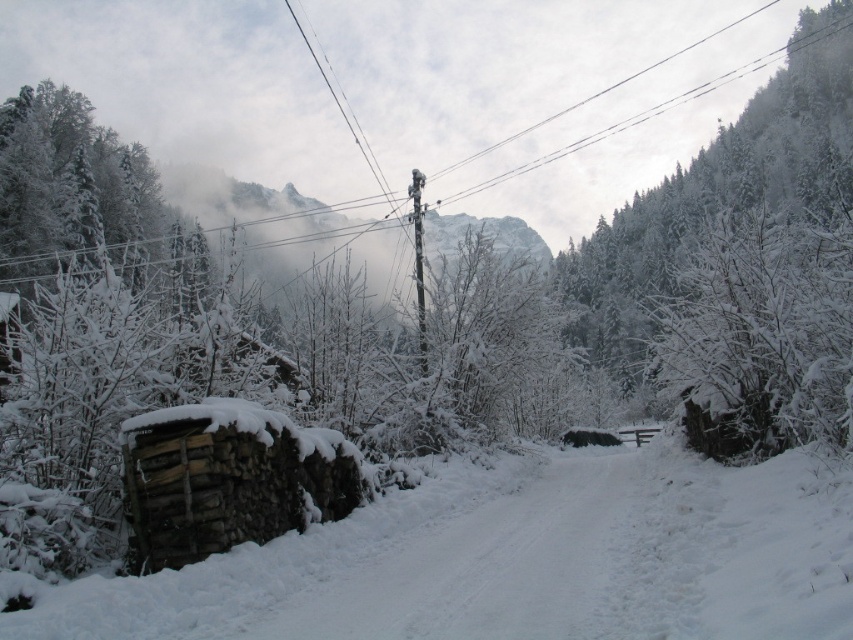
Who is more forward, (798,72) or (160,188)?

Positioned in front is point (160,188).

Is point (805, 177) more distant than point (57, 186)?

Yes.

The image size is (853, 640). I want to click on snow-covered evergreen at upper center, so click(x=717, y=193).

Does white frosty tree at right appear on the left side of white frosty trees at left?

No, white frosty tree at right is not to the left of white frosty trees at left.

Which is in front, point (840, 435) or point (12, 193)?

Point (840, 435) is in front.

The image size is (853, 640). Identify the location of white frosty tree at right. (759, 337).

Is point (775, 404) less distant than point (606, 246)?

Yes, point (775, 404) is closer to viewer.

Between white frosty tree at right and snow-covered evergreen at upper center, which one has less height?

Standing shorter between the two is white frosty tree at right.

Which is behind, point (844, 321) or point (672, 253)?

The point (672, 253) is behind.

This screenshot has width=853, height=640. Identify the location of white frosty tree at right. (759, 337).